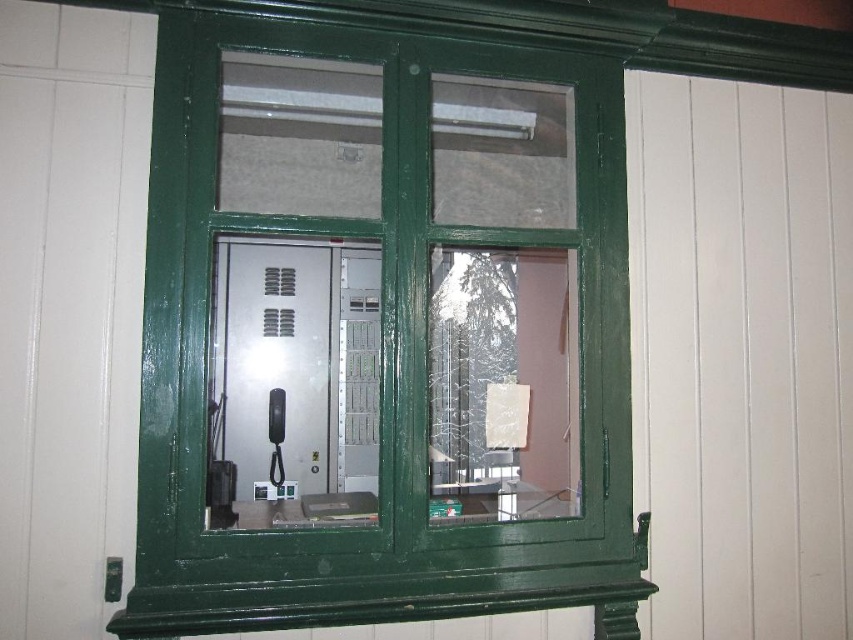
Is green painted wood at center above white matte curtain at right?

No.

Is green painted wood at center thinner than white matte curtain at right?

Incorrect, green painted wood at center's width is not less than white matte curtain at right's.

Is point (399, 308) closer to viewer compared to point (631, 262)?

Yes, point (399, 308) is closer to viewer.

The width and height of the screenshot is (853, 640). Identify the location of green painted wood at center. (384, 332).